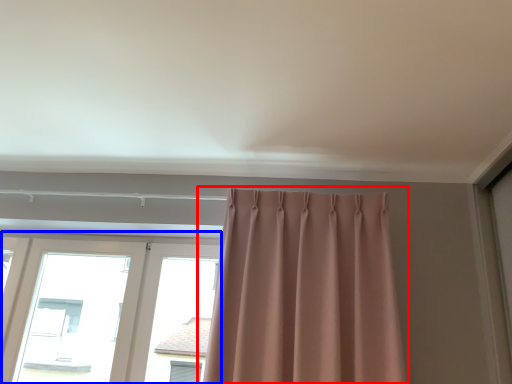
Question: Which of the following is the farthest to the observer, curtain (highlighted by a red box) or window (highlighted by a blue box)?

Choices:
 (A) curtain
 (B) window

Answer: (B)